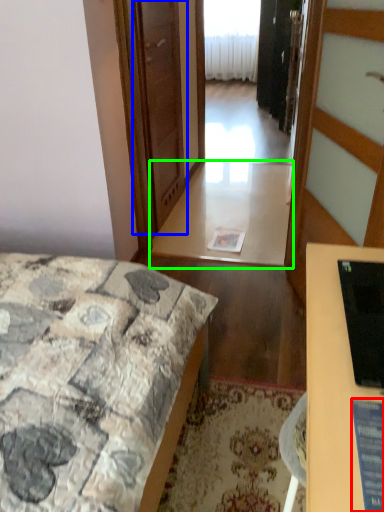
Question: Which object is the closest to the computer screen (highlighted by a red box)? Choose among these: screen door (highlighted by a blue box) or table (highlighted by a green box).

Choices:
 (A) screen door
 (B) table

Answer: (A)